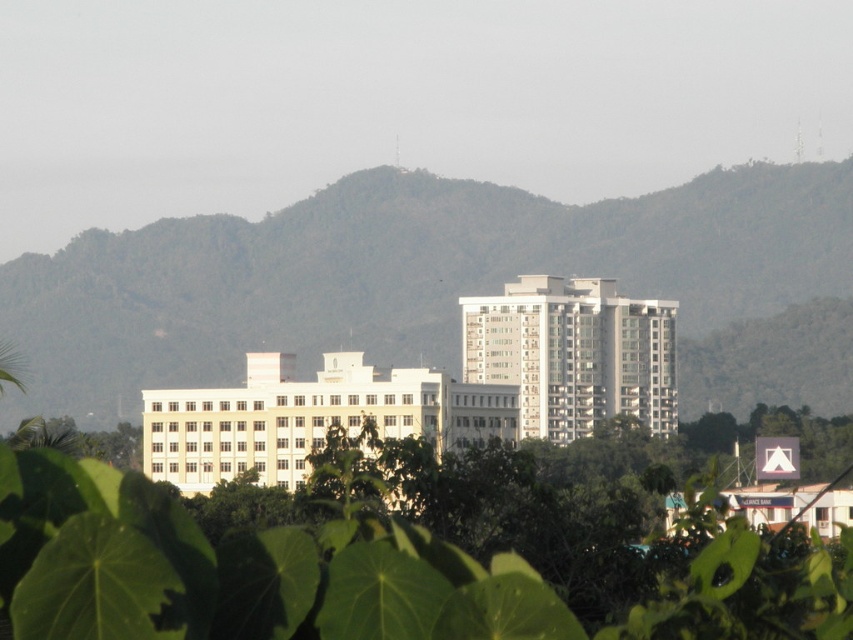
You are an architect designing a new observation deck. You need to ensure that the deck can provide a clear view of both the green leafy mountain at center and the green leafy tree at center. Based on their heights, which one will require you to position the deck at a higher elevation to see its full height?

The green leafy mountain at center has a greater height compared to the green leafy tree at center, so you will need to position the deck at a higher elevation to see its full height.

Based on the scene description, where is the green leafy mountain at center located in the image?

The green leafy mountain at center is located at point coordinates of (402, 275).

You are standing at the origin point in the cityscape and want to take a photo of both the point at coordinates point (358,184) and point (335,461). Which point will appear closer to the camera in your photo?

Point (335,461) will appear closer to the camera in the photo because it is in front of point (358,184) according to their positions.